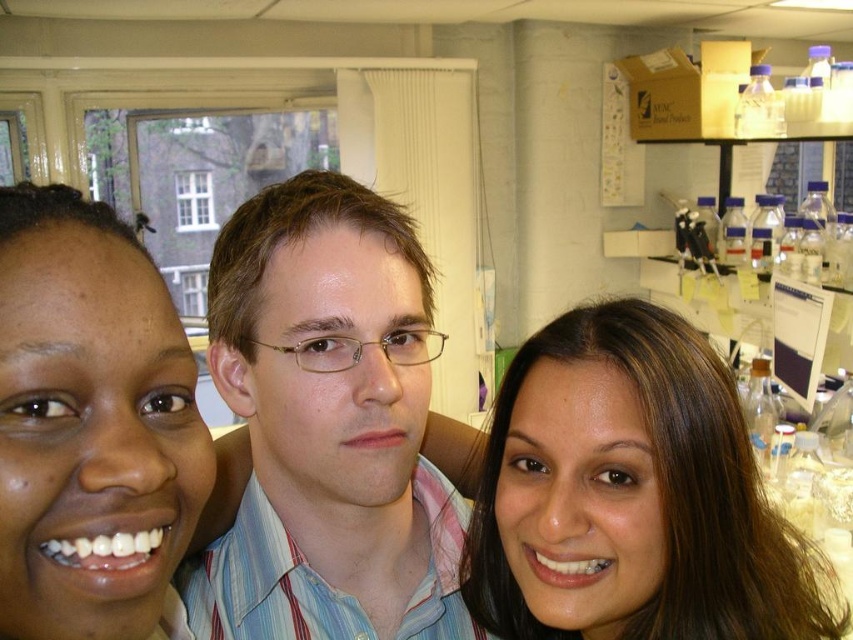
You are a photographer trying to capture a group photo of the light blue striped shirt at center and the smooth skin face at left. You want to ensure that both subjects are in focus. Given their positions, which subject should you focus on first to ensure proper alignment?

The light blue striped shirt at center is positioned under the smooth skin face at left, so focusing on the smooth skin face at left first would ensure proper alignment since it is higher in the frame.